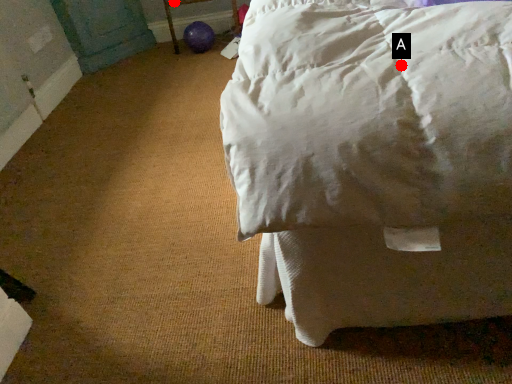
Question: Two points are circled on the image, labeled by A and B beside each circle. Which point is closer to the camera?

Choices:
 (A) A is closer
 (B) B is closer

Answer: (A)